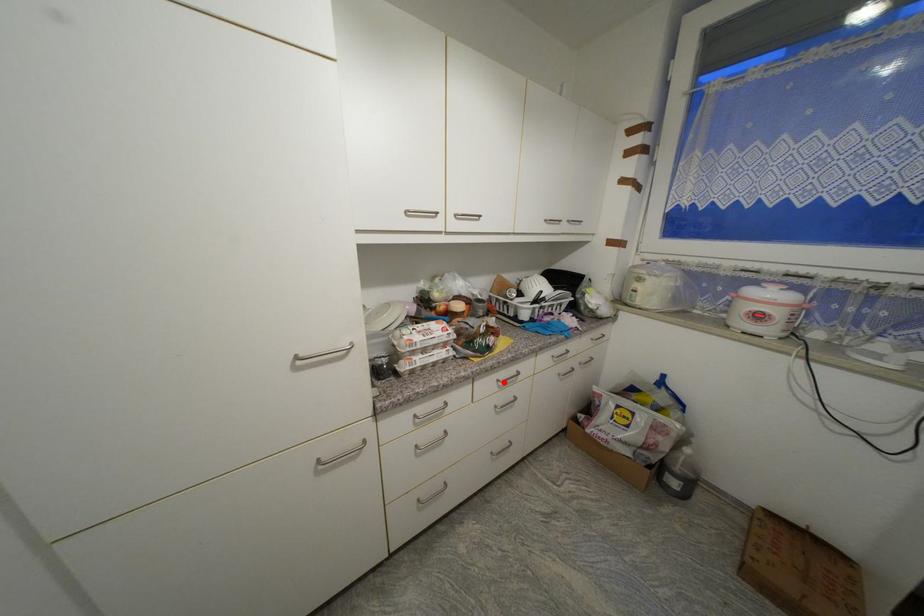
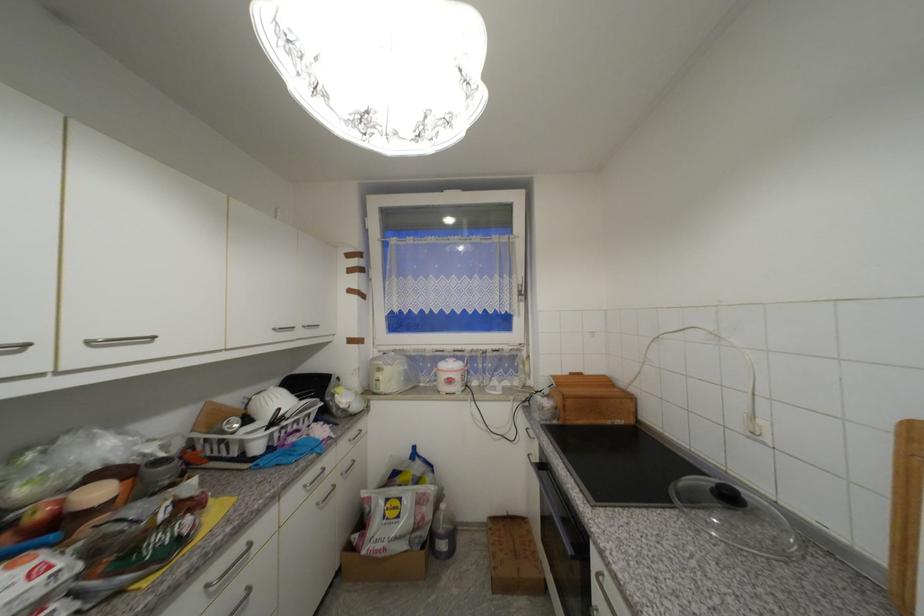
Question: I am providing you with two images of the same scene from different viewpoints. Image1 has a red point marked. In image2, the corresponding 3D location appears at what relative position? Reply with the corresponding letter.

Choices:
 (A) Closer
 (B) Farther

Answer: (A)